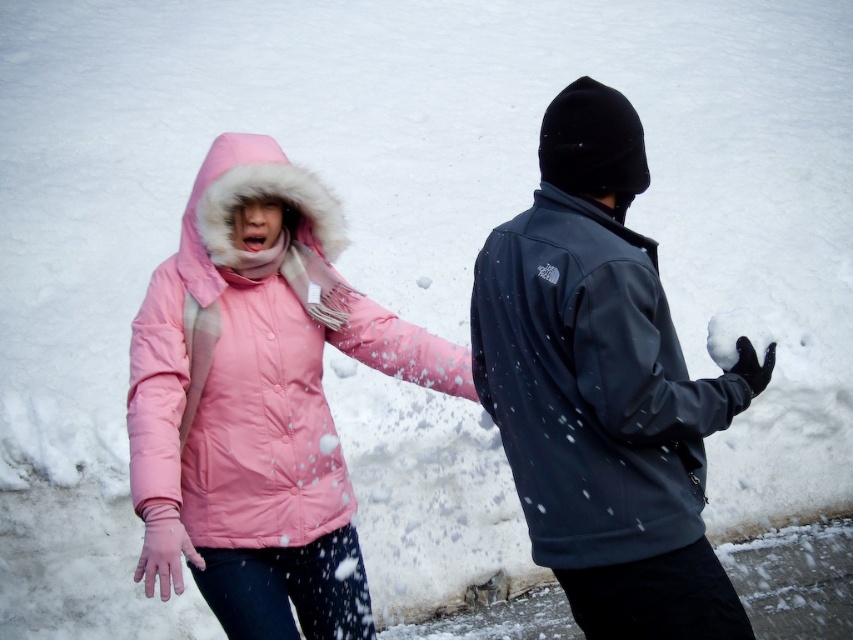
You are trying to decide which item to grab first from the snow. Based on their positions, which item is easier to reach? The dark gray fleece jacket at right or the black fuzzy glove at center?

The dark gray fleece jacket at right is closer to the viewer than the black fuzzy glove at center, so it is easier to reach.

You are standing at the camera position and want to throw a snowball at the pink down jacket at center. If your throwing range is 8 feet, will you be able to hit it?

The pink down jacket at center is 8.71 feet away from the camera. Since your throwing range is 8 feet, you cannot reach it, so you won cannot hit it.

You are trying to determine which object is wider between the pink down jacket at center and the black fuzzy glove at center in the snowball fight scene. Based on the description, which one has a greater width?

The pink down jacket at center is wider than the black fuzzy glove at center according to the description.